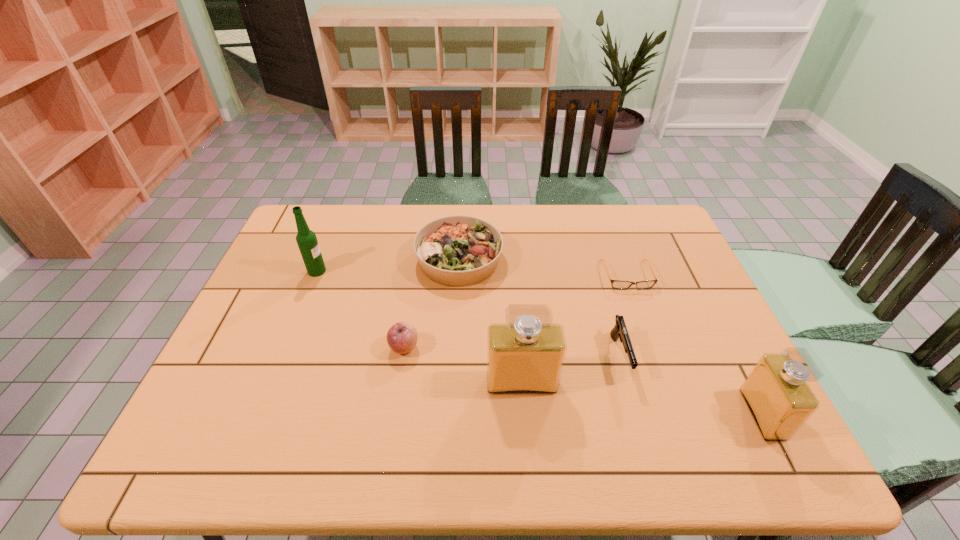
At what (x,y) coordinates should I click in order to perform the action: click on the left perfume. Please return your answer as a coordinate pair (x, y). The width and height of the screenshot is (960, 540). Looking at the image, I should click on (525, 355).

Find the location of a particular element. The image size is (960, 540). the rightmost object is located at coordinates click(776, 392).

Where is `the right perfume`? the right perfume is located at coordinates (776, 392).

The image size is (960, 540). Find the location of `salad plate`. salad plate is located at coordinates (457, 251).

Where is `the leftmost object`? the leftmost object is located at coordinates (306, 239).

The width and height of the screenshot is (960, 540). Find the location of `the sixth object from left to right`. the sixth object from left to right is located at coordinates (616, 284).

This screenshot has width=960, height=540. Find the location of `spectacles`. spectacles is located at coordinates (616, 284).

Identify the location of the third object from right to left. (620, 330).

At what (x,y) coordinates should I click in order to perform the action: click on apple. Please return your answer as a coordinate pair (x, y). This screenshot has width=960, height=540. Looking at the image, I should click on (402, 337).

Image resolution: width=960 pixels, height=540 pixels. I want to click on free space located 0.320m on the front-facing side of the shorter perfume, so click(x=608, y=414).